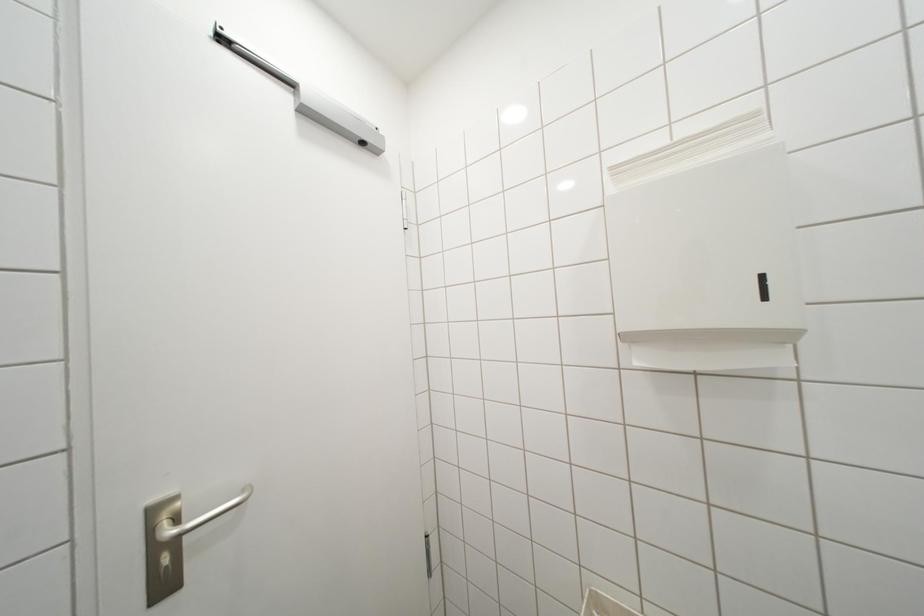
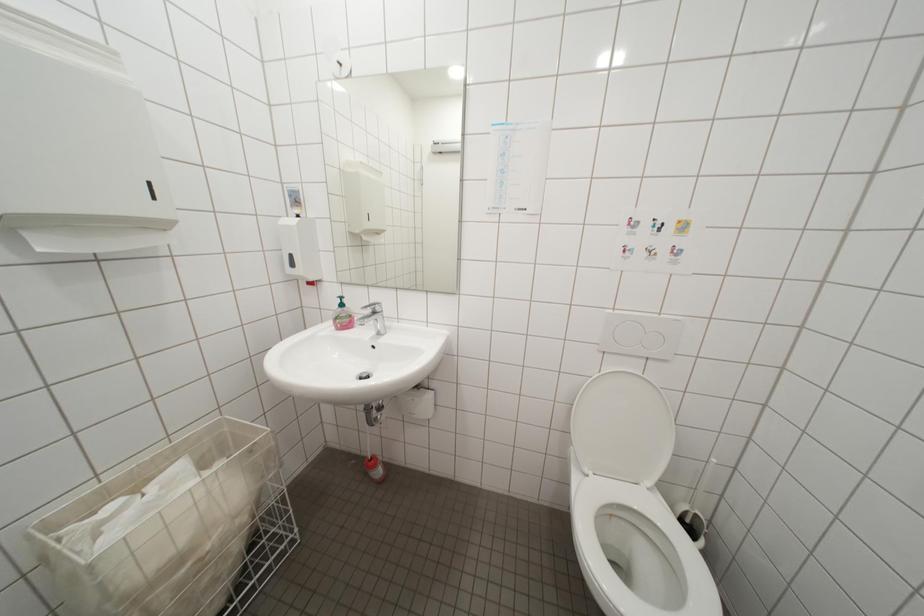
Question: The images are taken continuously from a first-person perspective. In which direction is your viewpoint rotating?

Choices:
 (A) Left
 (B) Right
 (C) Up
 (D) Down

Answer: (B)